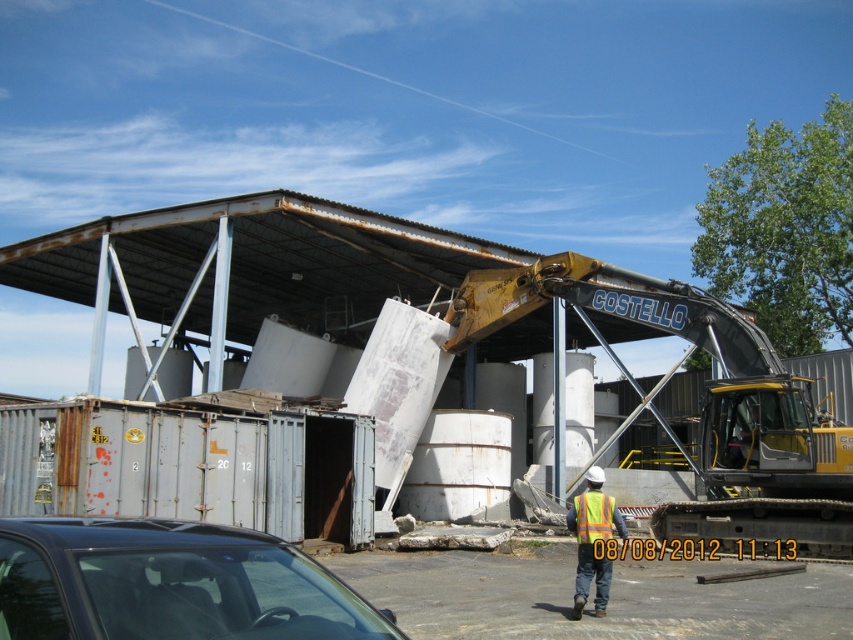
From the picture: You are a safety inspector assessing the industrial site. You notice the yellow metallic excavator at center and the reflective yellow safety vest at center. Which object is taller?

The yellow metallic excavator at center is taller than the reflective yellow safety vest at center.

You are driving a car that is 1.8 meters wide and want to park it in the same spot as the black glossy car at lower left. Can your car fit in that parking space if the yellow reflective vest at center is currently occupying the space?

The black glossy car at lower left has a width less than the yellow reflective vest at center. Since your car is 1.8 meters wide, you need to compare it with the vest width. But the vest is likely smaller than the car, so maybe not. Wait, the description says the car is narrower than the vest. So if the vest is in the space, the car might be too wide? Hmm, need to clarify.